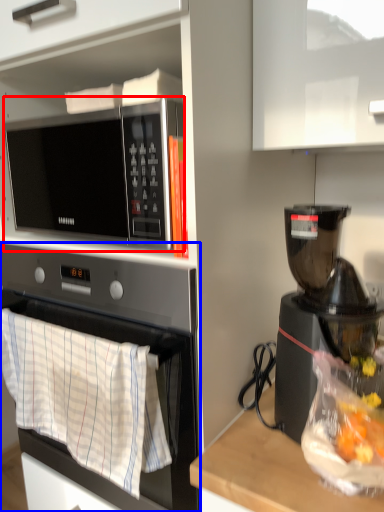
Question: Which of the following is the closest to the observer, microwave oven (highlighted by a red box) or oven (highlighted by a blue box)?

Choices:
 (A) microwave oven
 (B) oven

Answer: (B)